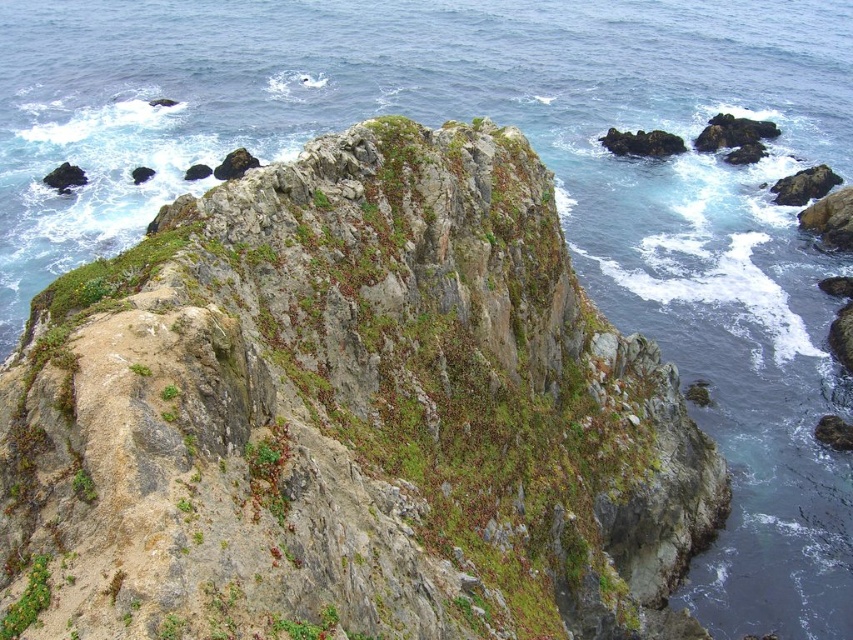
Question: Does green mossy rock at center lie in front of green mossy rock at lower left?

Choices:
 (A) yes
 (B) no

Answer: (A)

Question: In this image, where is green mossy rock at center located relative to green mossy rock at lower left?

Choices:
 (A) above
 (B) below

Answer: (A)

Question: Which point appears closest to the camera in this image?

Choices:
 (A) (454, 220)
 (B) (0, 637)

Answer: (B)

Question: Does green mossy rock at center appear under green mossy rock at lower left?

Choices:
 (A) yes
 (B) no

Answer: (B)

Question: Which object appears closest to the camera in this image?

Choices:
 (A) green mossy rock at center
 (B) green mossy rock at lower left

Answer: (A)